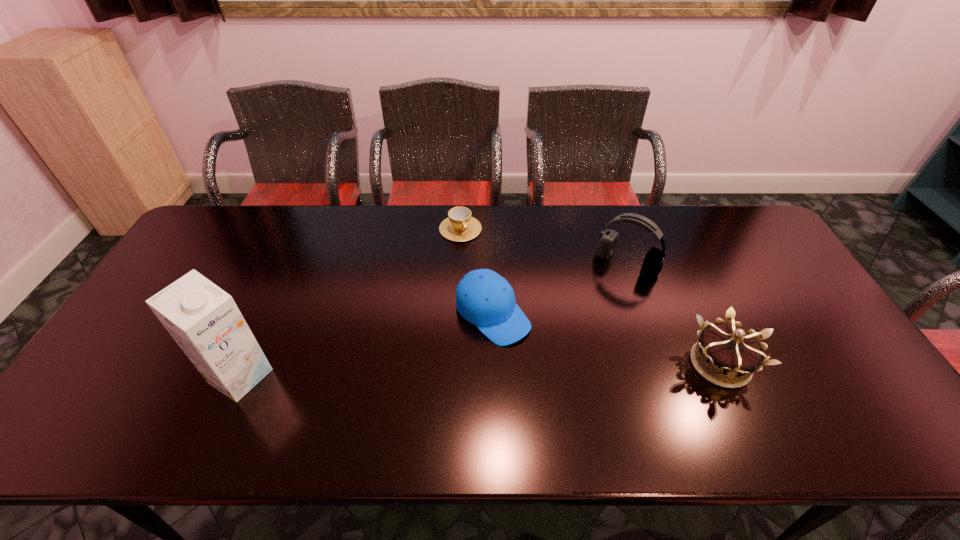
At what (x,y) coordinates should I click in order to perform the action: click on headset situated at the far edge. Please return your answer as a coordinate pair (x, y). This screenshot has width=960, height=540. Looking at the image, I should click on (652, 265).

Where is `carton that is positioned at the near edge`? carton that is positioned at the near edge is located at coordinates (204, 320).

The width and height of the screenshot is (960, 540). In order to click on crown that is at the near edge in this screenshot , I will do `click(727, 349)`.

In the image, there is a desktop. Where is `free region at the far edge`? This screenshot has width=960, height=540. free region at the far edge is located at coordinates (531, 215).

Identify the location of blank area at the near edge. point(260,393).

The image size is (960, 540). Identify the location of vacant space at the right edge of the desktop. (836, 342).

This screenshot has width=960, height=540. Find the location of `vacant space at the near left corner of the desktop`. vacant space at the near left corner of the desktop is located at coordinates (132, 387).

Identify the location of vacant point located between the crown and the shortest object. This screenshot has height=540, width=960. pyautogui.click(x=590, y=296).

Identify the location of free space that is in between the shortest object and the leftmost object. (350, 302).

I want to click on vacant point located between the third tallest object and the tallest object, so [x=480, y=370].